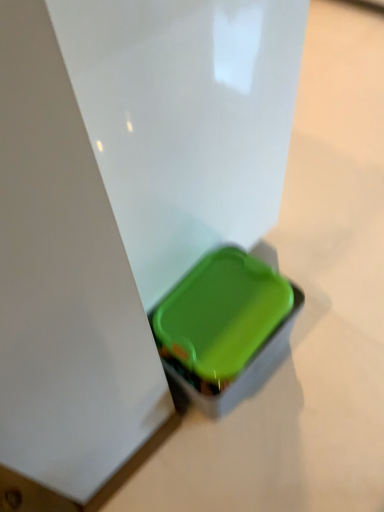
Image resolution: width=384 pixels, height=512 pixels. Find the location of `free point to the right of green plastic container at lower center`. free point to the right of green plastic container at lower center is located at coordinates (325, 352).